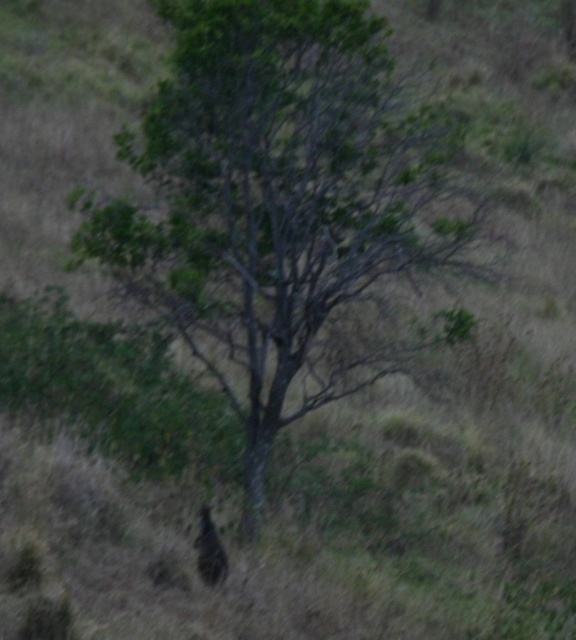
You are a hiker who wants to take a photo of the green leafy tree at center and the brown furry animal at lower center. Which one should you zoom in on more to capture both in the frame?

Answer: The green leafy tree at center is smaller than the brown furry animal at lower center, so you should zoom in more on the tree to ensure both fit in the frame.

You are standing at the point marked by coordinates point (282, 204) in the image. What object are you directly at?

You are directly at the green leafy tree at center, as the point (282, 204) represents its location.

You are a wildlife photographer aiming to capture both the green leafy tree at center and the brown furry animal at lower center in a single frame. Based on their sizes, which object should you focus on to ensure both are visible without zooming in or out?

The green leafy tree at center might be wider than brown furry animal at lower center, so you should focus on the green leafy tree at center to ensure both are visible without zooming in or out.